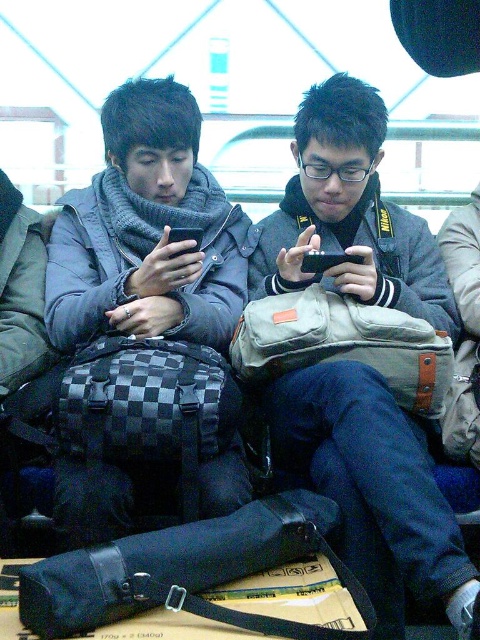
You are a photographer trying to capture a candid shot of the two people sitting on the bench. You notice the matte gray scarf at center and the canvas messenger bag at center. Which object is covering the other?

The matte gray scarf at center is positioned over the canvas messenger bag at center, so the scarf is covering the bag.

You are a photographer carrying a camera bag. You see the black canvas camera bag at lower center in the image. Where should you place your camera bag so that it is exactly at the coordinates point (189, 572)?

The black canvas camera bag at lower center is already placed exactly at the coordinates point (189, 572) as indicated by the description.

You are a photographer who needs to access your camera gear. You are sitting on a bench with two people next to you. You have a black canvas camera bag at lower center. Where should you look to find your bag?

The black canvas camera bag at lower center is located at the 2D coordinates point (189,572), so you should look at that specific point to find your bag.